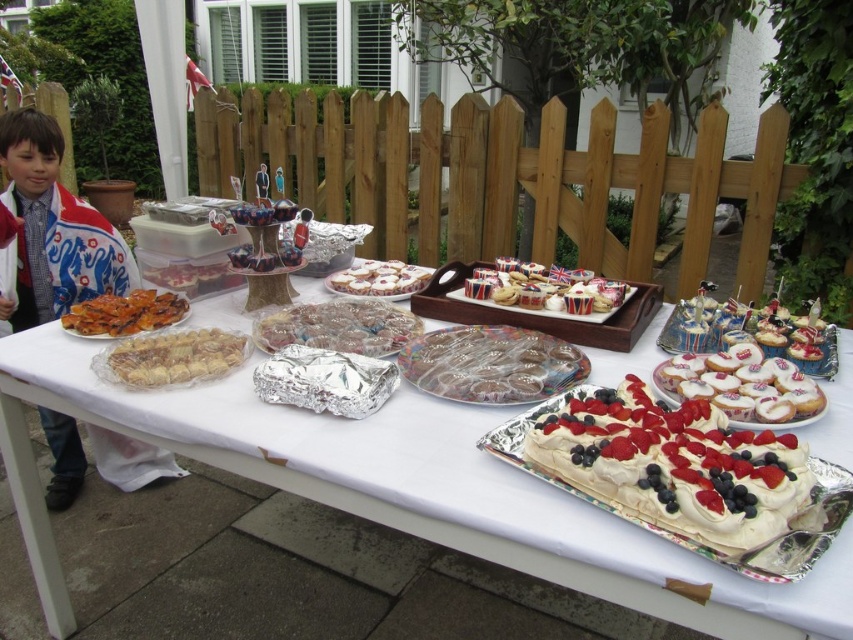
You are organizing a picnic and need to decide whether to bring the white fabric scarf at left or the translucent plastic cookies at center. Since you have limited space, which item takes up more space horizontally?

The white fabric scarf at left takes up more space horizontally because its width is larger than that of the translucent plastic cookies at center.

You are at a garden party and see the white paper table at center and the union jack paper cupcake at center. Which object is closer to you?

The union jack paper cupcake at center is closer to you because it is above the white paper table at center, which is below it.